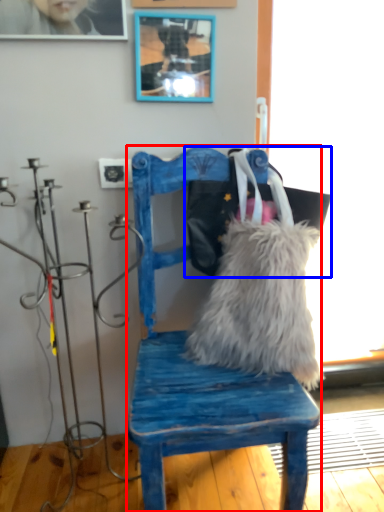
Question: Which object is closer to the camera taking this photo, chair (highlighted by a red box) or messenger bag (highlighted by a blue box)?

Choices:
 (A) chair
 (B) messenger bag

Answer: (A)